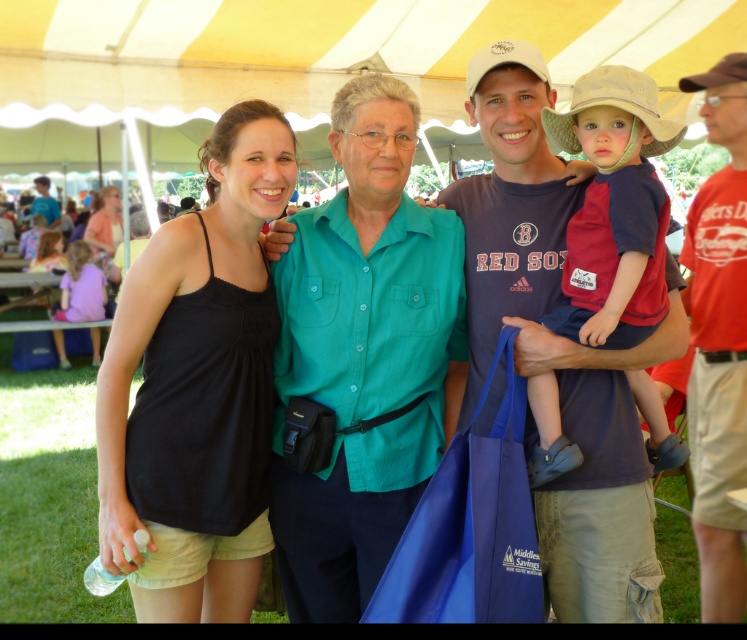
Question: Among these points, which one is farthest from the camera?

Choices:
 (A) (102, 234)
 (B) (406, 280)
 (C) (624, 452)
 (D) (49, 186)

Answer: (D)

Question: Among these objects, which one is farthest from the camera?

Choices:
 (A) matte blue shirt at center
 (B) beige fabric cowboy hat at upper right
 (C) red cotton shirt at right

Answer: (C)

Question: Which point is farther to the camera?

Choices:
 (A) beige fabric cowboy hat at upper right
 (B) matte black shirt at left
 (C) brown fabric cowboy hat at upper right

Answer: (B)

Question: Where is matte blue shirt at center located in relation to matte black shirt at left in the image?

Choices:
 (A) left
 (B) right

Answer: (B)

Question: Can you confirm if teal button-down shirt at center is positioned to the left of red cotton shirt at right?

Choices:
 (A) no
 (B) yes

Answer: (B)

Question: Is teal button-down shirt at center positioned in front of matte blue shirt at center?

Choices:
 (A) yes
 (B) no

Answer: (B)